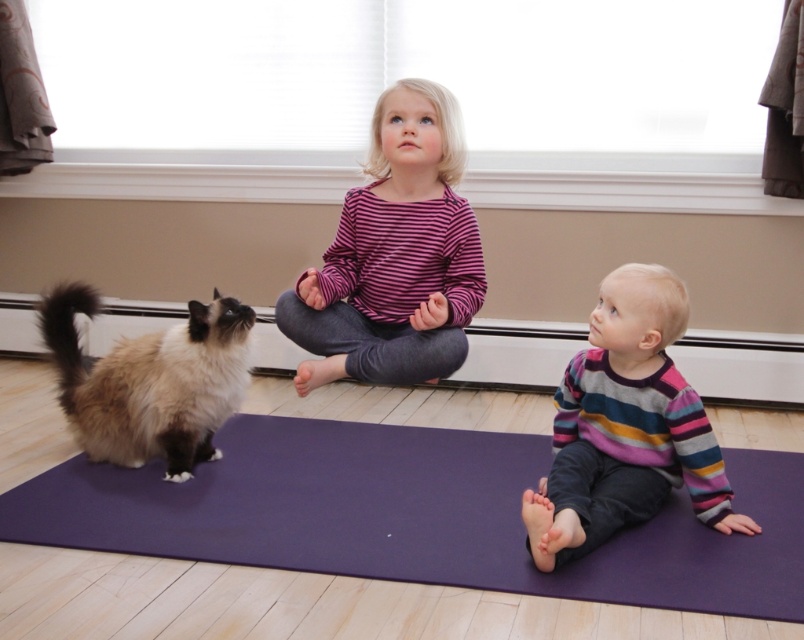
You are standing at the entrance of the room and want to place a small potted plant exactly at point (394, 256). However, there is an object already occupying that location. What object is blocking the placement of the potted plant at that specific point?

The striped cotton shirt at center is located at point (394, 256), so it is blocking the placement of the potted plant there.

You are a toy robot that is 12 inches wide. You are standing on the purple yoga mat at lower center and want to move to the striped sweater at lower right. Can you fit through the space between them without moving the objects?

The distance between the purple yoga mat at lower center and the striped sweater at lower right is 14.67 inches. Since the robot is 12 inches wide, it can fit through the space as the distance is greater than the robot width.

You are a parent trying to find your children in a room. You see the purple yoga mat at lower center and the striped sweater at lower right. Which object is closer to you?

The purple yoga mat at lower center is closer to you because it is in front of the striped sweater at lower right.